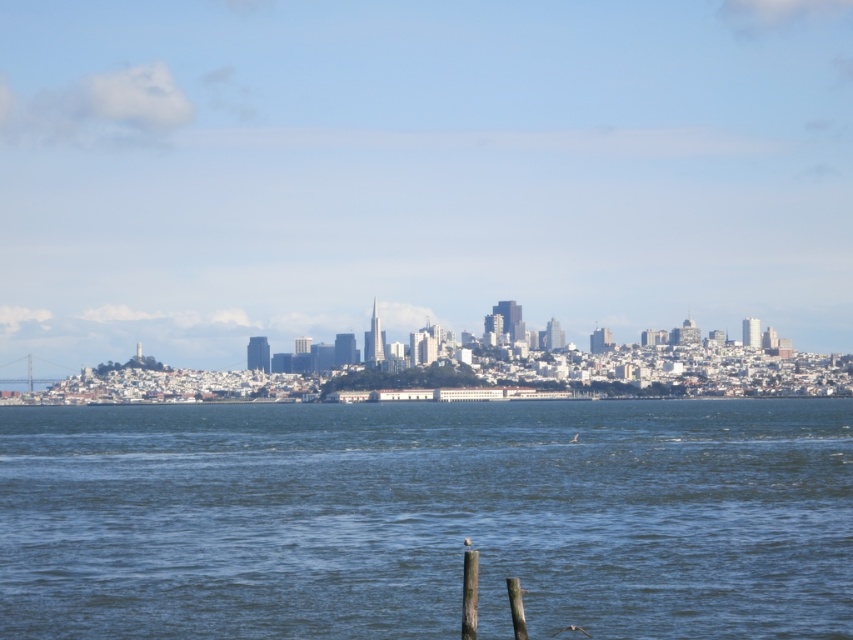
Question: Does blue water at center appear on the right side of smooth wood post at lower center?

Choices:
 (A) yes
 (B) no

Answer: (A)

Question: Is blue water at center wider than smooth wood post at lower center?

Choices:
 (A) yes
 (B) no

Answer: (A)

Question: Does blue water at center appear over smooth wood post at lower center?

Choices:
 (A) no
 (B) yes

Answer: (A)